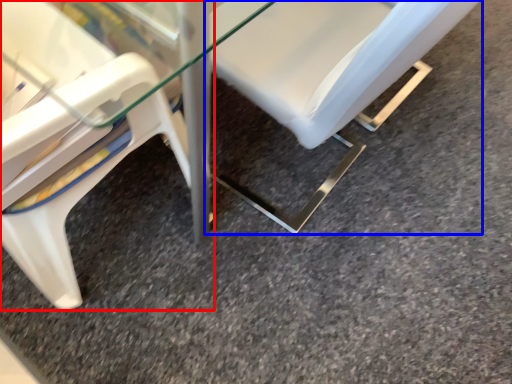
Question: Which object is closer to the camera taking this photo, chair (highlighted by a red box) or chair (highlighted by a blue box)?

Choices:
 (A) chair
 (B) chair

Answer: (A)